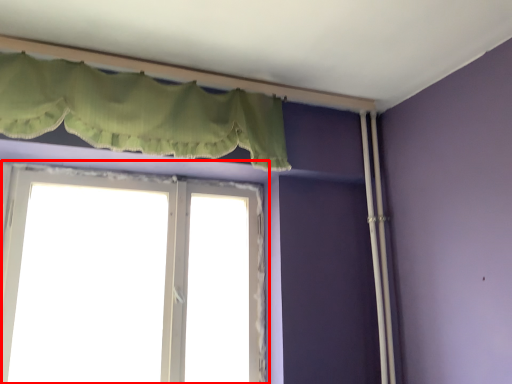
Question: From the image's perspective, considering the relative positions of window (annotated by the red box) and curtain in the image provided, where is window (annotated by the red box) located with respect to the staircase?

Choices:
 (A) below
 (B) above

Answer: (A)